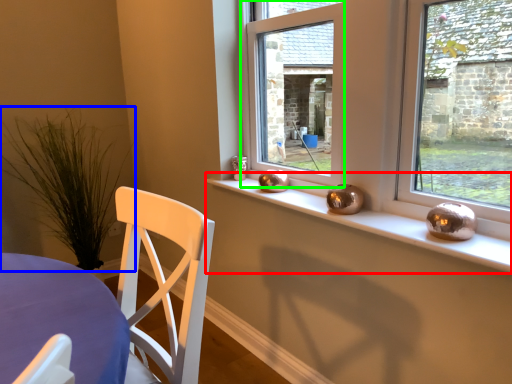
Question: Estimate the real-world distances between objects in this image. Which object is farther from window sill (highlighted by a red box), plant (highlighted by a blue box) or window (highlighted by a green box)?

Choices:
 (A) plant
 (B) window

Answer: (A)